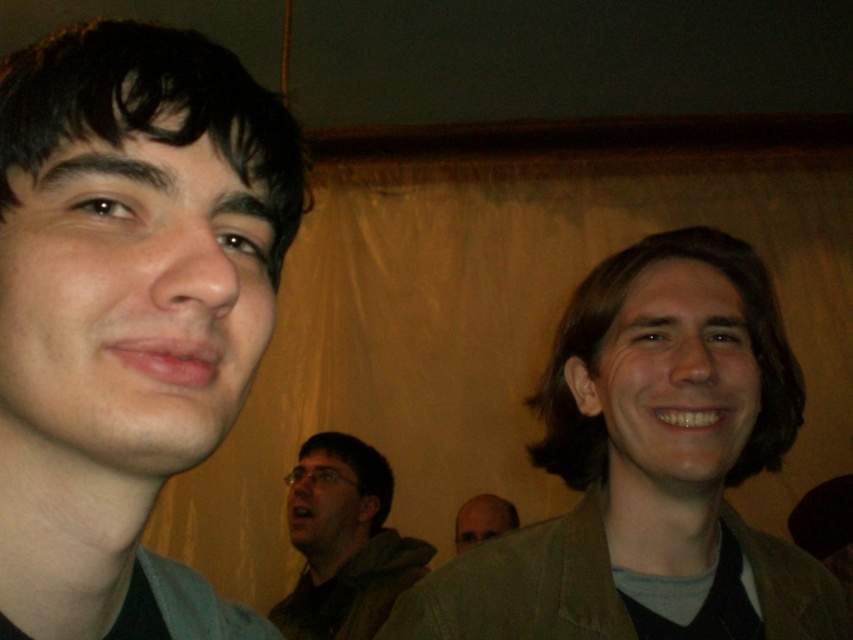
Which is more to the right, green fabric jacket at lower center or bald head at center?

bald head at center is more to the right.

Looking at this image, is green fabric jacket at lower center positioned before bald head at center?

Yes.

Measure the distance between green fabric jacket at lower center and camera.

A distance of 1.96 meters exists between green fabric jacket at lower center and camera.

Where is `green fabric jacket at lower center`? green fabric jacket at lower center is located at coordinates (344, 541).